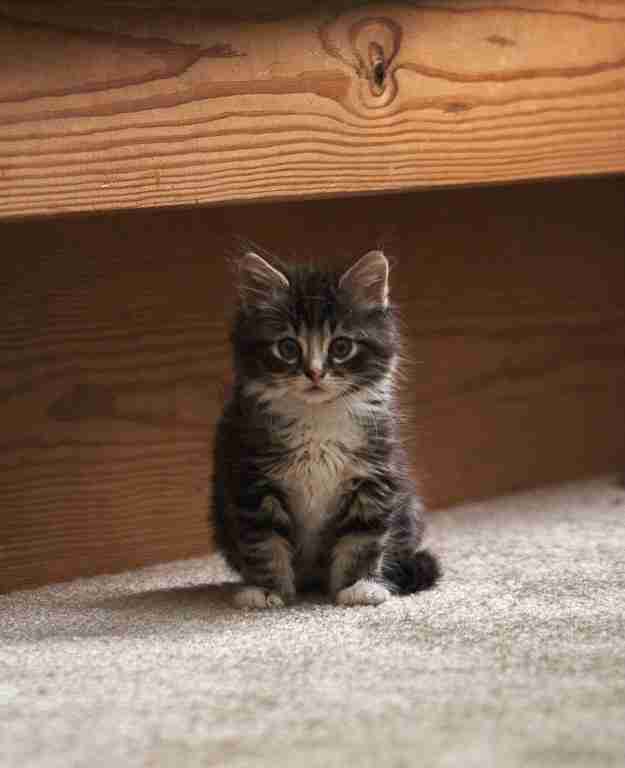
Locate an element on the screen. Image resolution: width=625 pixels, height=768 pixels. grey caarpet is located at coordinates (532, 660).